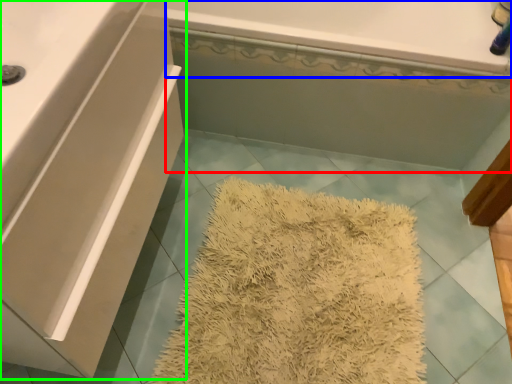
Question: Considering the real-world distances, which object is farthest from bath (highlighted by a red box)? bath (highlighted by a blue box) or bathroom cabinet (highlighted by a green box)?

Choices:
 (A) bath
 (B) bathroom cabinet

Answer: (B)